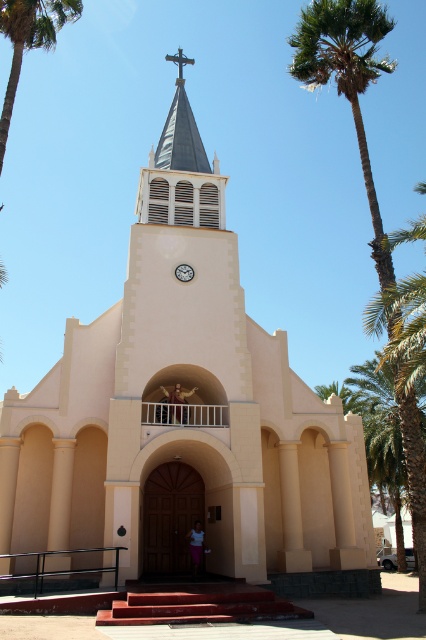
Question: Which of the following is the closest to the observer?

Choices:
 (A) green leafy palm tree at upper left
 (B) smooth beige statue at upper center
 (C) white fabric person at center

Answer: (A)

Question: Among these points, which one is nearest to the camera?

Choices:
 (A) pos(181,413)
 (B) pos(42,13)
 (C) pos(195,570)

Answer: (C)

Question: From the image, what is the correct spatial relationship of green leafy palm tree at upper left in relation to smooth beige statue at upper center?

Choices:
 (A) below
 (B) above

Answer: (B)

Question: Which is farther from the white fabric person at center?

Choices:
 (A) smooth beige statue at upper center
 (B) green leafy palm tree at upper left

Answer: (B)

Question: From the image, what is the correct spatial relationship of green leafy palm tree at upper left in relation to smooth beige statue at upper center?

Choices:
 (A) below
 (B) above

Answer: (B)

Question: Can you confirm if green leafy palm tree at upper left is wider than smooth beige statue at upper center?

Choices:
 (A) no
 (B) yes

Answer: (B)